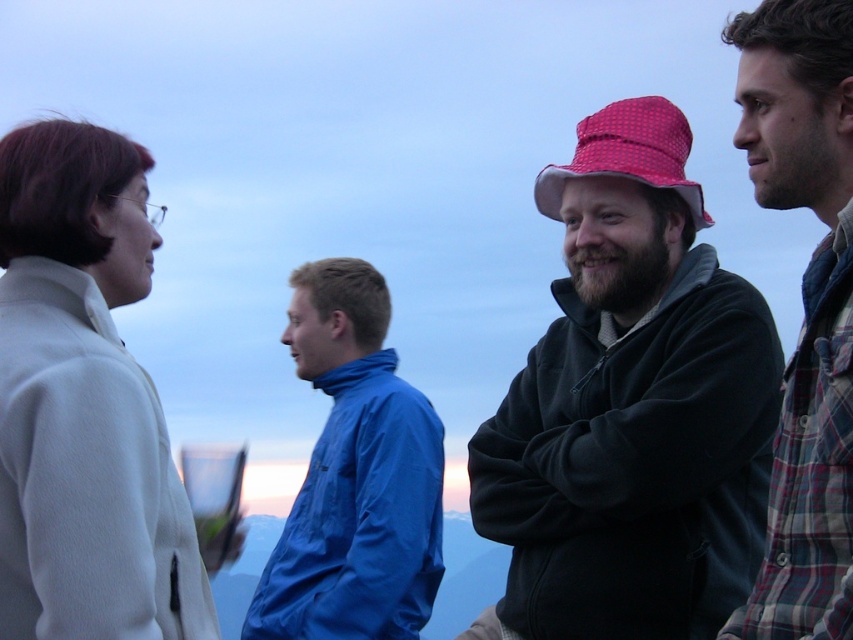
Is white fleece jacket at left shorter than red checkered fabric hat at center?

In fact, white fleece jacket at left may be taller than red checkered fabric hat at center.

This screenshot has height=640, width=853. In order to click on white fleece jacket at left in this screenshot , I will do `click(84, 403)`.

What do you see at coordinates (84, 403) in the screenshot?
I see `white fleece jacket at left` at bounding box center [84, 403].

Locate an element on the screen. white fleece jacket at left is located at coordinates (84, 403).

Is point (827, 284) closer to viewer compared to point (695, 216)?

Yes, point (827, 284) is in front of point (695, 216).

Based on the photo, is plaid flannel shirt at right positioned in front of red checkered fabric hat at center?

That is True.

Describe the element at coordinates (804, 308) in the screenshot. I see `plaid flannel shirt at right` at that location.

Image resolution: width=853 pixels, height=640 pixels. I want to click on plaid flannel shirt at right, so click(x=804, y=308).

From the picture: Who is taller, white fleece jacket at left or plaid flannel shirt at right?

With more height is plaid flannel shirt at right.

Locate an element on the screen. This screenshot has width=853, height=640. white fleece jacket at left is located at coordinates (84, 403).

Where is `white fleece jacket at left`? white fleece jacket at left is located at coordinates (84, 403).